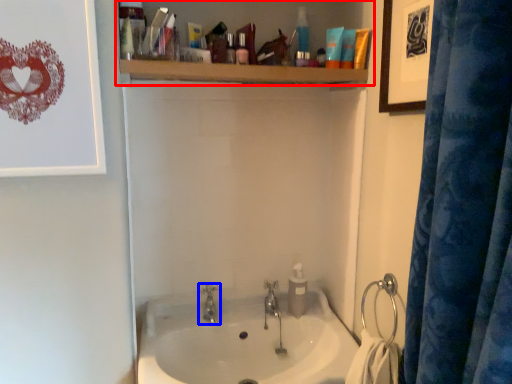
Question: Which point is further to the camera, bathroom cabinet (highlighted by a red box) or tap (highlighted by a blue box)?

Choices:
 (A) bathroom cabinet
 (B) tap

Answer: (B)